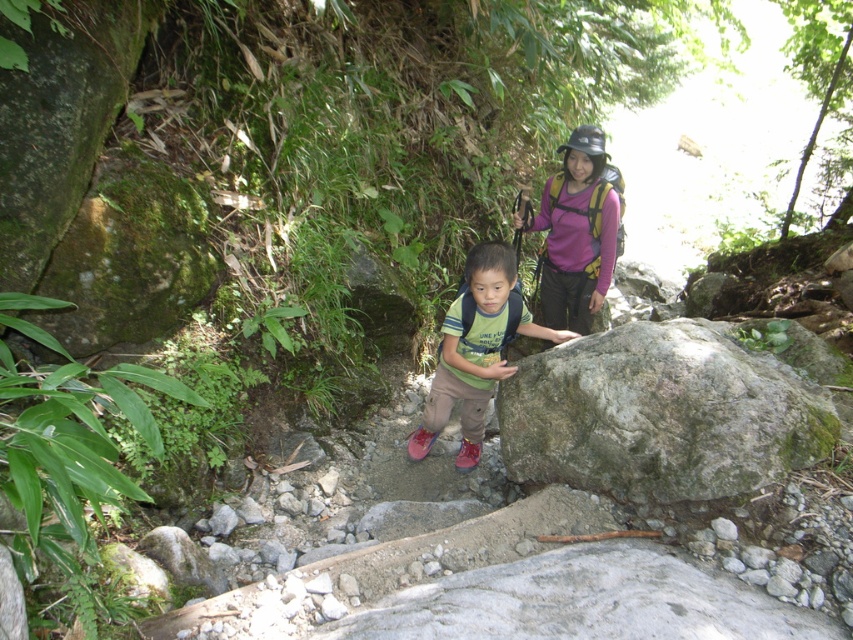
Question: Which of the following is the closest to the observer?

Choices:
 (A) (561, 273)
 (B) (480, 449)
 (C) (764, 474)

Answer: (C)

Question: Is green mossy rock at center to the left of purple fabric backpack at upper center from the viewer's perspective?

Choices:
 (A) no
 (B) yes

Answer: (A)

Question: Does green mossy rock at center come behind green matte shirt at center?

Choices:
 (A) yes
 (B) no

Answer: (B)

Question: Which object is the closest to the purple fabric backpack at upper center?

Choices:
 (A) green mossy rock at center
 (B) green matte shirt at center

Answer: (B)

Question: Is the position of green matte shirt at center less distant than that of purple fabric backpack at upper center?

Choices:
 (A) yes
 (B) no

Answer: (A)

Question: Which object is positioned farthest from the green matte shirt at center?

Choices:
 (A) purple fabric backpack at upper center
 (B) green mossy rock at center

Answer: (A)